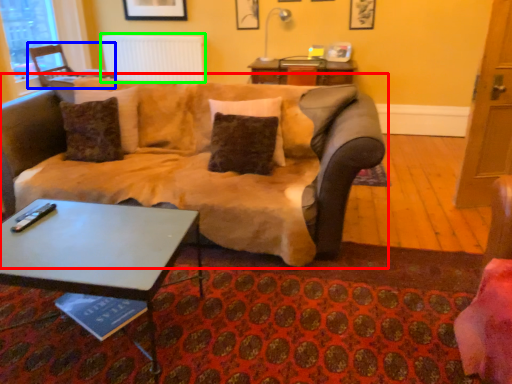
Question: Based on their relative distances, which object is farther from studio couch (highlighted by a red box)? Choose from chair (highlighted by a blue box) and radiator (highlighted by a green box).

Choices:
 (A) chair
 (B) radiator

Answer: (B)